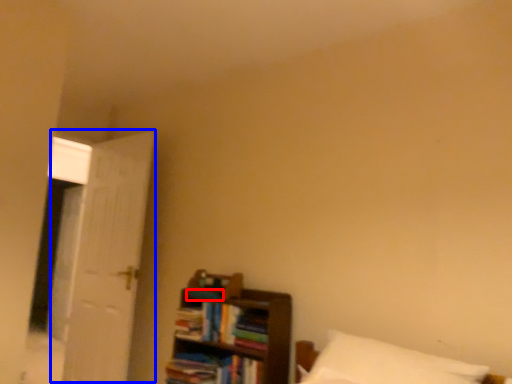
Question: Which of the following is the farthest to the observer, book (highlighted by a red box) or door (highlighted by a blue box)?

Choices:
 (A) book
 (B) door

Answer: (B)